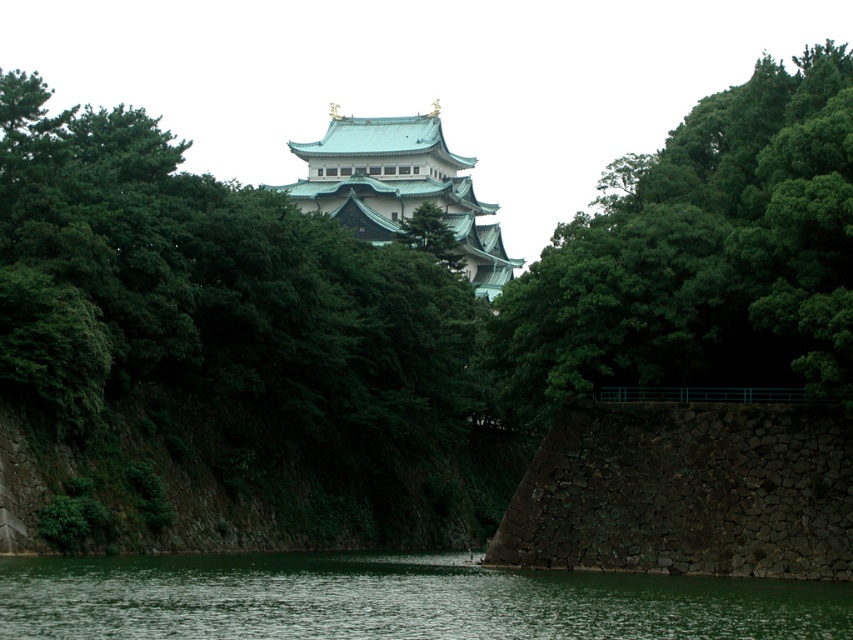
Consider the image. You are a drone operator tasked with capturing aerial footage of the traditional Japanese castle. Your drone has a maximum flight range of 50 meters. You notice the green leafy tree at upper center in your camera view. Can your drone safely fly past this tree to reach the castle without exceeding its range limit?

The green leafy tree at upper center is 56.92 meters from the camera, which is beyond the drone operator drone has a maximum flight range of 50 meters. Therefore, the drone cannot safely fly past the green leafy tree at upper center to reach the castle without exceeding its range limit.

You are standing in front of the traditional Japanese castle and notice a point marked at coordinates (701, 253). What object is located at that point?

The green leafy tree at upper center is located at point (701, 253).